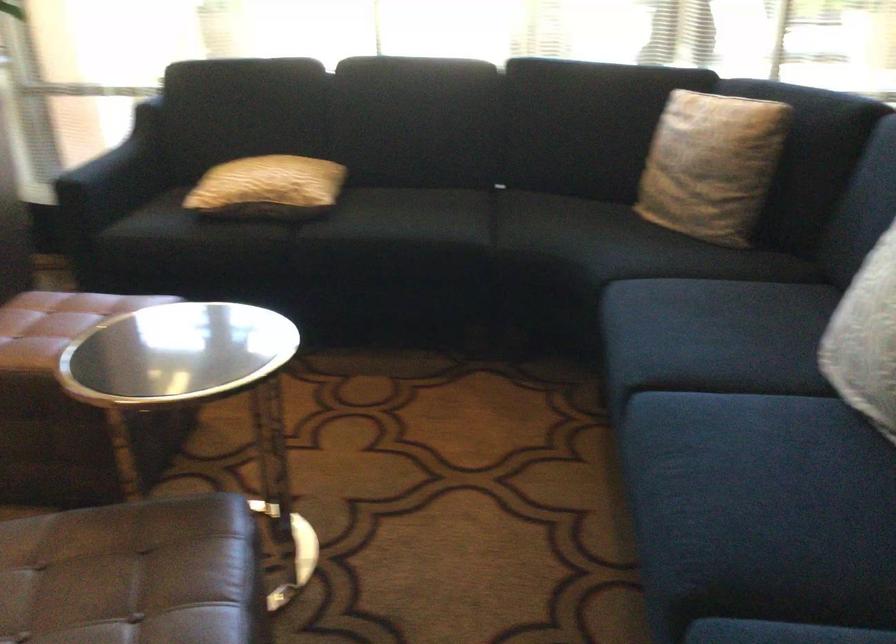
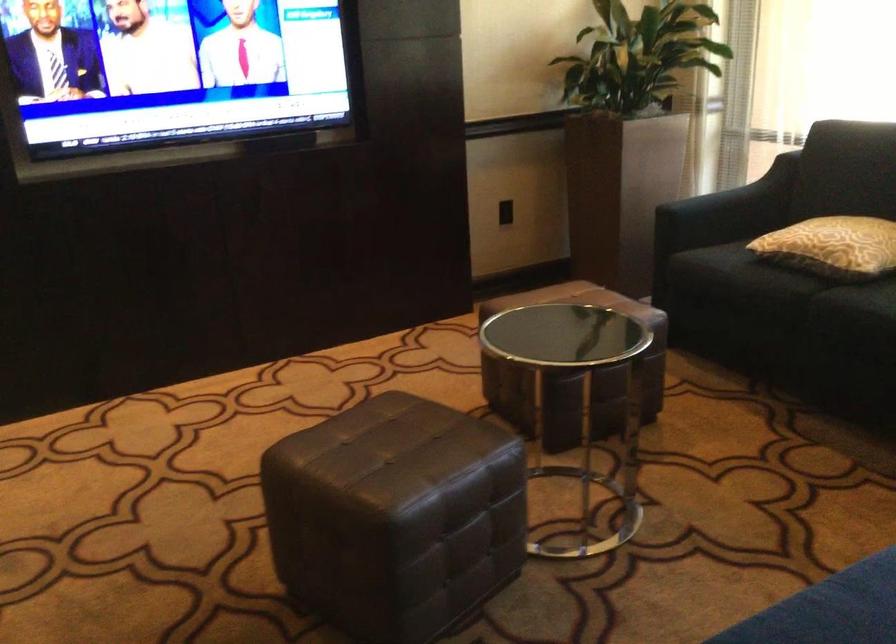
Locate, in the second image, the point that corresponds to (x=234, y=242) in the first image.

(767, 283)